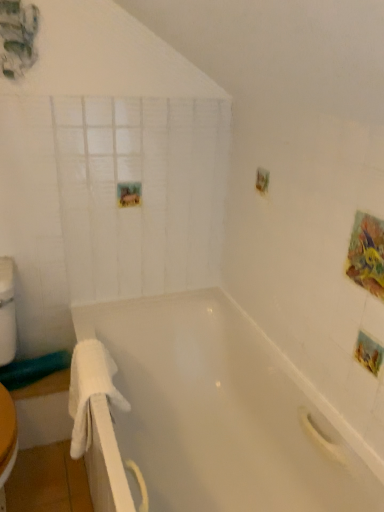
Question: Considering the relative sizes of white matte glass door at upper left and white fluffy towel at left in the image provided, is white matte glass door at upper left shorter than white fluffy towel at left?

Choices:
 (A) no
 (B) yes

Answer: (A)

Question: Is white matte glass door at upper left behind white fluffy towel at left?

Choices:
 (A) yes
 (B) no

Answer: (A)

Question: Considering the relative sizes of white matte glass door at upper left and white fluffy towel at left in the image provided, is white matte glass door at upper left thinner than white fluffy towel at left?

Choices:
 (A) yes
 (B) no

Answer: (A)

Question: Can white fluffy towel at left be found inside white matte glass door at upper left?

Choices:
 (A) yes
 (B) no

Answer: (B)

Question: Is white matte glass door at upper left at the left side of white fluffy towel at left?

Choices:
 (A) no
 (B) yes

Answer: (A)

Question: Is white matte glass door at upper left looking in the opposite direction of white fluffy towel at left?

Choices:
 (A) yes
 (B) no

Answer: (B)

Question: Can you confirm if white fluffy towel at left is shorter than white matte glass door at upper left?

Choices:
 (A) yes
 (B) no

Answer: (A)

Question: From a real-world perspective, is white fluffy towel at left under white matte glass door at upper left?

Choices:
 (A) no
 (B) yes

Answer: (B)

Question: Is white fluffy towel at left bigger than white matte glass door at upper left?

Choices:
 (A) no
 (B) yes

Answer: (A)

Question: Is white fluffy towel at left at the right side of white matte glass door at upper left?

Choices:
 (A) no
 (B) yes

Answer: (A)

Question: Considering the relative sizes of white fluffy towel at left and white matte glass door at upper left in the image provided, is white fluffy towel at left smaller than white matte glass door at upper left?

Choices:
 (A) yes
 (B) no

Answer: (A)

Question: Is the surface of white fluffy towel at left in direct contact with white matte glass door at upper left?

Choices:
 (A) yes
 (B) no

Answer: (B)

Question: Can you confirm if white fluffy towel at left is positioned to the left of white glossy bathtub at center?

Choices:
 (A) no
 (B) yes

Answer: (B)